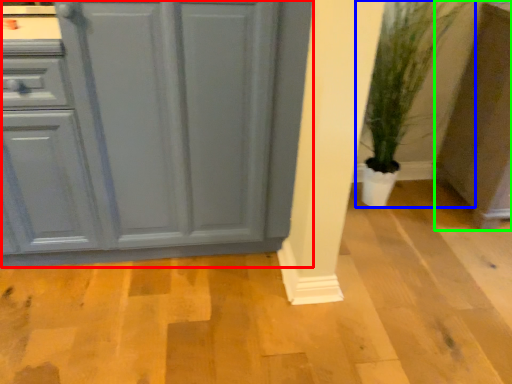
Question: Considering the real-world distances, which object is farthest from cabinetry (highlighted by a red box)? houseplant (highlighted by a blue box) or cabinetry (highlighted by a green box)?

Choices:
 (A) houseplant
 (B) cabinetry

Answer: (B)